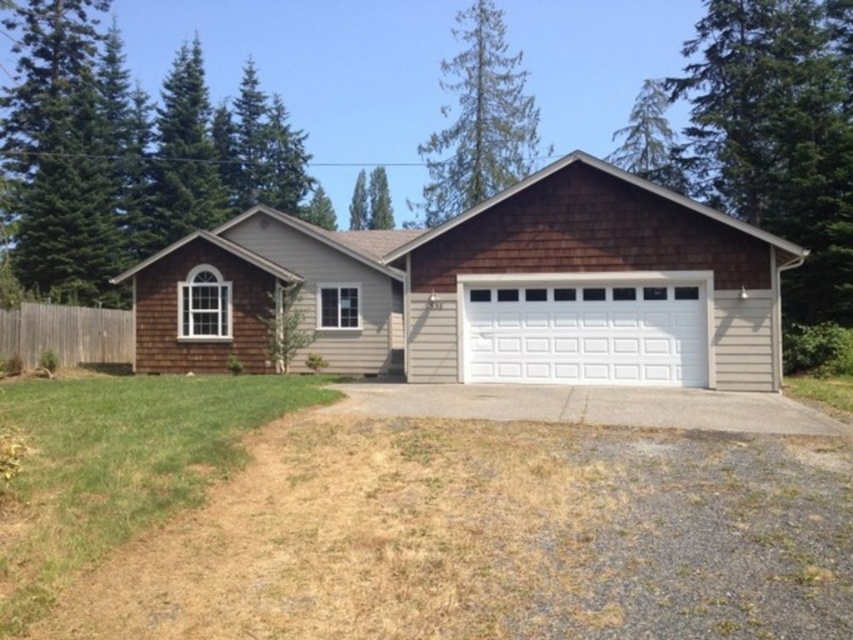
You are standing in front of the house and notice the brown shingles at center and the white painted wood garage door at center. Which object is closer to you?

The brown shingles at center are closer to you because they are in front of the white painted wood garage door at center.

You are a delivery driver arriving at the house. You need to park your vehicle on the gray asphalt driveway at center. However, there is a white painted wood garage door at center in the way. Can you park your vehicle on the driveway without blocking the garage door?

The white painted wood garage door at center is positioned on the right side of gray asphalt driveway at center, so you can park on the driveway as long as you avoid the area where the garage door is located on the right side.